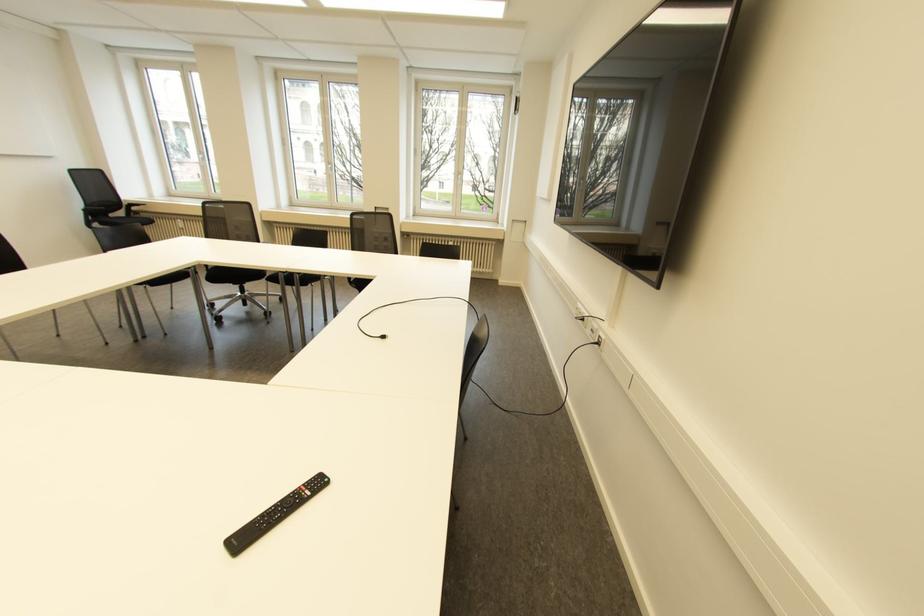
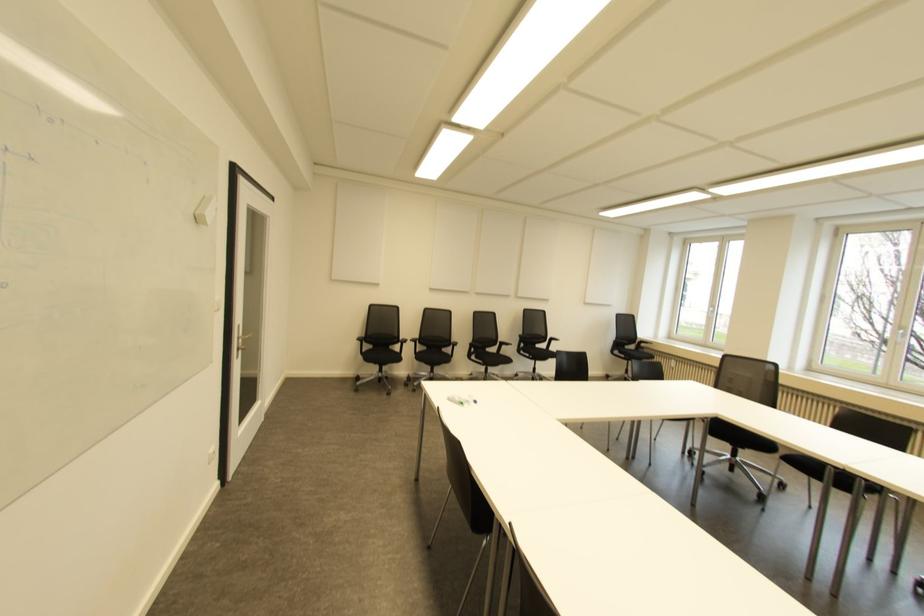
Question: The first image is from the beginning of the video and the second image is from the end. How did the camera likely rotate when shooting the video?

Choices:
 (A) Left
 (B) Right
 (C) Up
 (D) Down

Answer: (A)